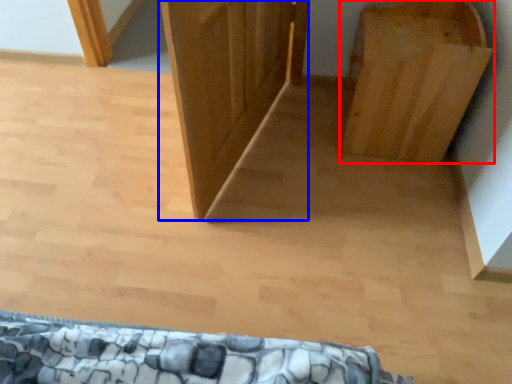
Question: Which object is closer to the camera taking this photo, furniture (highlighted by a red box) or door (highlighted by a blue box)?

Choices:
 (A) furniture
 (B) door

Answer: (B)